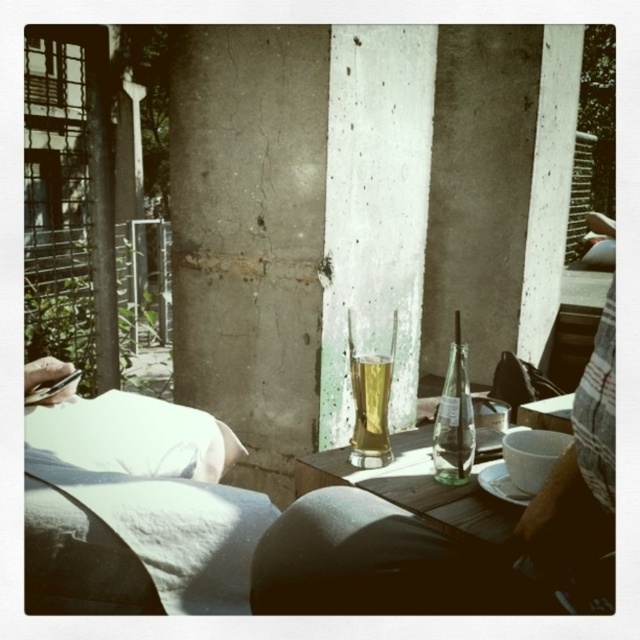
You are taking a photo of the scene and want to focus on both point (305, 464) and point (384, 358). Which point should you focus on first to ensure both are in focus?

You should focus on point (305, 464) first because it is closer to the camera than point (384, 358). By focusing on the closer point, the depth of field will likely include the farther point as well.

From the picture: You are at a rustic outdoor patio with two beers on the table. The clear glass beer at center and the translucent glass beer at center. Which one is bigger?

The clear glass beer at center is larger in size compared to the translucent glass beer at center.